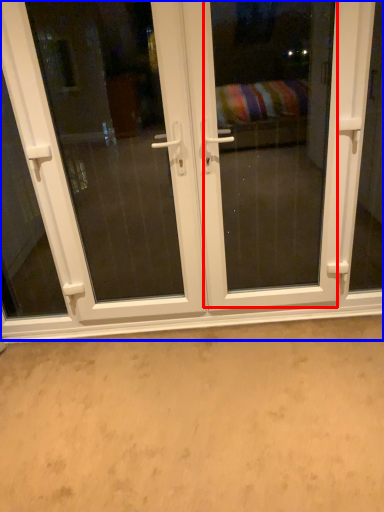
Question: Which object is further to the camera taking this photo, screen door (highlighted by a red box) or door (highlighted by a blue box)?

Choices:
 (A) screen door
 (B) door

Answer: (B)